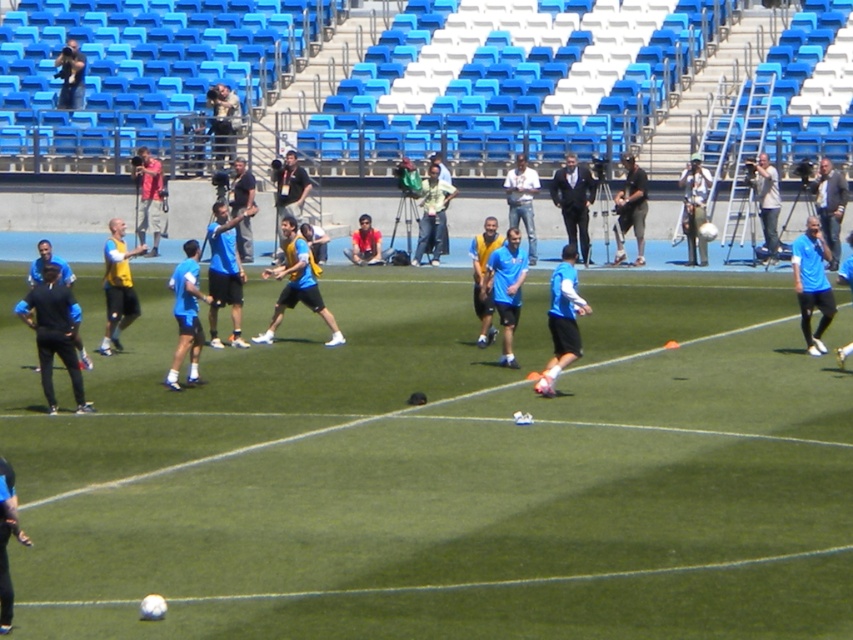
Question: Is blue matte soccer players at center to the left of blue fabric camera at upper right from the viewer's perspective?

Choices:
 (A) yes
 (B) no

Answer: (A)

Question: Is blue matte soccer players at center closer to camera compared to blue matte shirt at center?

Choices:
 (A) no
 (B) yes

Answer: (B)

Question: Which point appears closest to the camera in this image?

Choices:
 (A) (502, 266)
 (B) (706, 554)
 (C) (827, 301)
 (D) (775, 188)

Answer: (B)

Question: Based on their relative distances, which object is nearer to the matte blue shorts at center?

Choices:
 (A) matte blue shirt at center
 (B) blue fabric camera at upper right
 (C) dark suit at center

Answer: (A)

Question: In this image, where is black matte suit at center located relative to blue fabric camera at upper right?

Choices:
 (A) above
 (B) below

Answer: (A)

Question: Which point is closer to the camera taking this photo?

Choices:
 (A) (314, 276)
 (B) (161, 202)

Answer: (A)